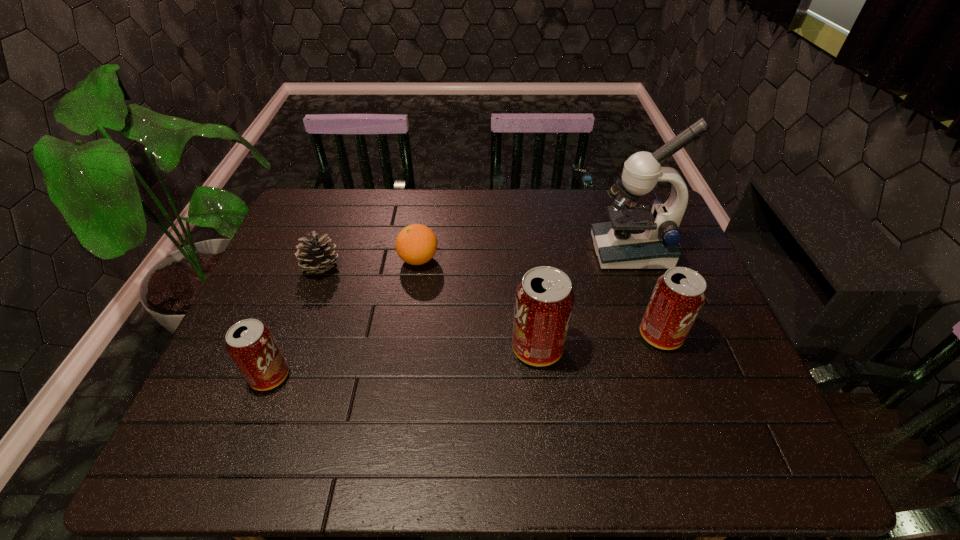
Locate an element on the screen. The height and width of the screenshot is (540, 960). the shortest soda can is located at coordinates (250, 343).

I want to click on the leftmost soda can, so click(x=250, y=343).

This screenshot has width=960, height=540. What are the coordinates of `the fourth object from left to right` in the screenshot? It's located at (544, 300).

The height and width of the screenshot is (540, 960). In order to click on the third tallest object in this screenshot , I will do `click(678, 296)`.

This screenshot has width=960, height=540. I want to click on the second shortest soda can, so click(678, 296).

This screenshot has height=540, width=960. What are the coordinates of `microscope` in the screenshot? It's located at (638, 237).

The image size is (960, 540). Identify the location of pinecone. (315, 256).

Identify the location of the third object from left to right. This screenshot has height=540, width=960. (416, 244).

Where is `free space located 0.130m on the right of the fourth tallest object`? This screenshot has width=960, height=540. free space located 0.130m on the right of the fourth tallest object is located at coordinates (346, 376).

Where is `vacant space located 0.180m on the right of the fourth object from left to right`? The image size is (960, 540). vacant space located 0.180m on the right of the fourth object from left to right is located at coordinates (636, 348).